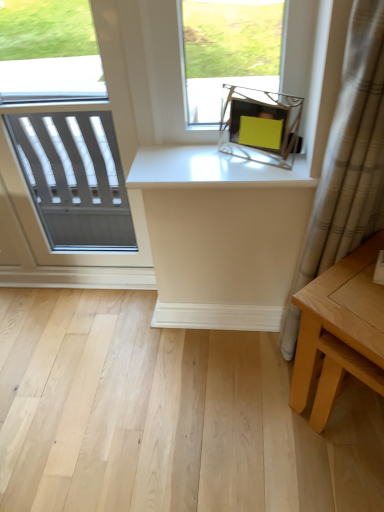
Question: In terms of size, does light brown wooden table at lower right appear bigger or smaller than beige textured curtain at right?

Choices:
 (A) big
 (B) small

Answer: (A)

Question: From a real-world perspective, relative to beige textured curtain at right, is light brown wooden table at lower right vertically above or below?

Choices:
 (A) below
 (B) above

Answer: (A)

Question: Which of these objects is positioned farthest from the beige textured curtain at right?

Choices:
 (A) white glossy counter top at upper center
 (B) light brown wooden table at lower right
 (C) white textured window at left

Answer: (C)

Question: Which object is positioned farthest from the white textured window at left?

Choices:
 (A) beige textured curtain at right
 (B) light brown wooden table at lower right
 (C) white glossy counter top at upper center

Answer: (B)